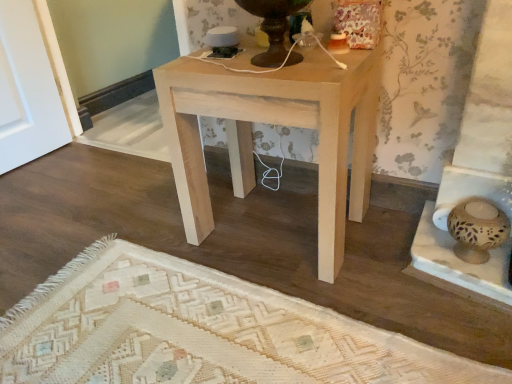
Where is `natural wood table at center`? The width and height of the screenshot is (512, 384). natural wood table at center is located at coordinates [275, 124].

The width and height of the screenshot is (512, 384). What do you see at coordinates (275, 124) in the screenshot? I see `natural wood table at center` at bounding box center [275, 124].

I want to click on natural wood table at center, so click(275, 124).